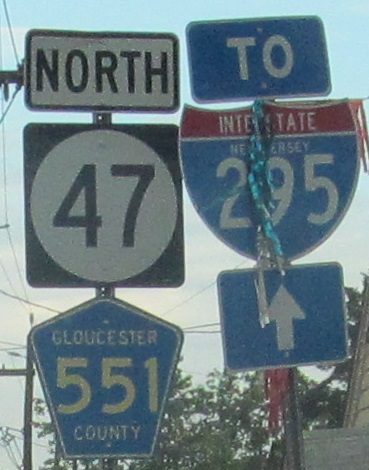
Where is `red streamers`? red streamers is located at coordinates (273, 379).